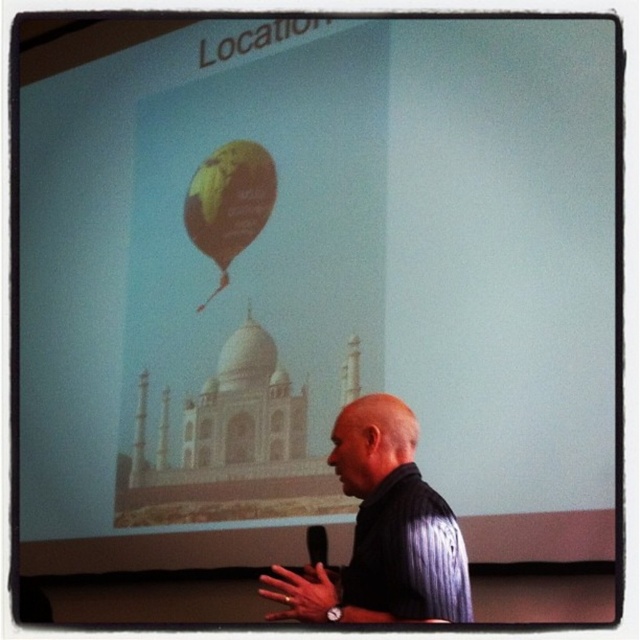
You are a photographer standing in the presentation room. You want to capture a photo of the black striped shirt at lower right and the yellow fabric balloon at upper center in the same frame. Given that your camera has a maximum focus range of 8 feet, will you be able to take the photo without moving closer?

The distance between the black striped shirt at lower right and the yellow fabric balloon at upper center is 7.80 feet, which is within the camera maximum focus range of 8 feet. Therefore, you can take the photo without moving closer.

You are an attendee at the presentation and want to know which point is closer to you. The presenter is pointing at two points on the slide. The first point is labeled as point (381, 474) and the second is point (184, 209). Which point is closer to you?

Point (381, 474) is in front of point (184, 209), so it is closer to you.

You are standing in the presentation room and want to take a photo of the speaker. The speaker is wearing a black striped shirt at lower right. Where should you position your camera to capture the speaker clearly?

Position your camera so it faces the black striped shirt at lower right, which is located at coordinates approximately 0.831 on the x axis and 0.598 on the y axis.